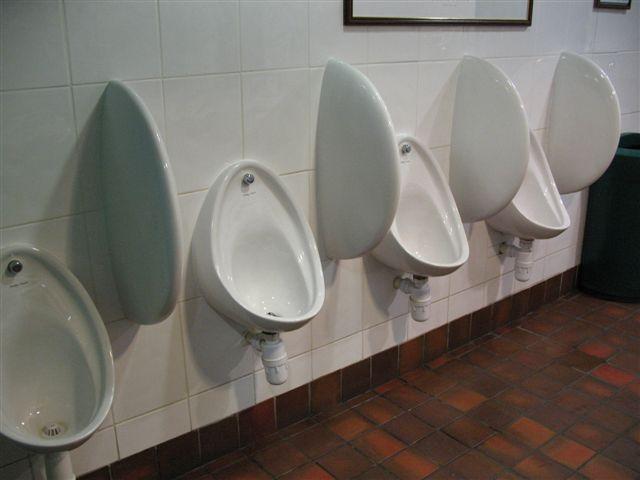
In order to click on brown tile floor in this screenshot , I will do `click(492, 426)`.